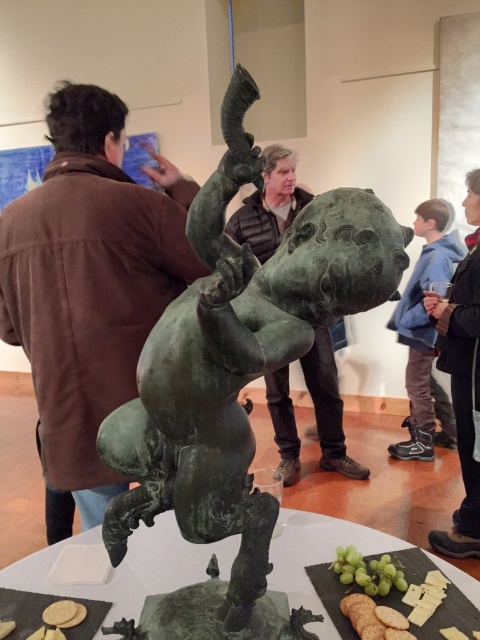
Question: Is green patina bronze statue at center above blue denim jacket at upper right?

Choices:
 (A) yes
 (B) no

Answer: (B)

Question: Estimate the real-world distances between objects in this image. Which object is closer to the green matte grapes at lower center?

Choices:
 (A) blue denim jacket at right
 (B) green marble table at center
 (C) white crumbly cheese at lower left
 (D) bronze statue at center

Answer: (B)

Question: Does green marble table at center appear under bronze statue at center?

Choices:
 (A) yes
 (B) no

Answer: (A)

Question: Which point is farther from the camera taking this photo?

Choices:
 (A) (286, 196)
 (B) (376, 584)
 (C) (458, 333)

Answer: (A)

Question: Estimate the real-world distances between objects in this image. Which object is closer to the smooth white biscuit at lower left?

Choices:
 (A) green matte grapes at lower center
 (B) white crumbly cheese at lower left
 (C) brown leather jacket at upper left
 (D) green patina bronze statue at center

Answer: (B)

Question: Is green marble table at center to the right of bronze statue at center from the viewer's perspective?

Choices:
 (A) no
 (B) yes

Answer: (A)